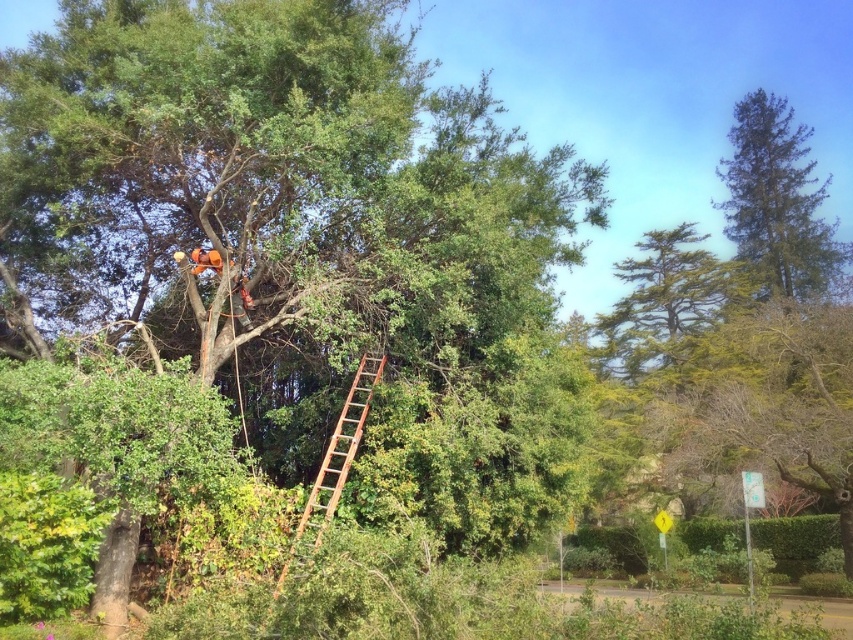
From the picture: Does green textured tree at upper right appear over rusty wood ladder at center?

Indeed, green textured tree at upper right is positioned over rusty wood ladder at center.

Image resolution: width=853 pixels, height=640 pixels. I want to click on green textured tree at upper right, so click(x=665, y=304).

Is point (695, 340) behind point (310, 508)?

Yes, point (695, 340) is farther from viewer.

Find the location of `green textured tree at upper right`. green textured tree at upper right is located at coordinates (665, 304).

The image size is (853, 640). Describe the element at coordinates (276, 202) in the screenshot. I see `green leafy tree at upper center` at that location.

Does green leafy tree at upper center have a smaller size compared to green textured tree at upper right?

Indeed, green leafy tree at upper center has a smaller size compared to green textured tree at upper right.

Which is in front, point (148, 284) or point (675, 364)?

Positioned in front is point (148, 284).

Identify the location of green leafy tree at upper center. (276, 202).

Is point (450, 132) farther from viewer compared to point (335, 440)?

That is True.

Is green leafy tree at upper center wider than rusty wood ladder at center?

Yes, green leafy tree at upper center is wider than rusty wood ladder at center.

This screenshot has height=640, width=853. I want to click on green leafy tree at upper center, so click(276, 202).